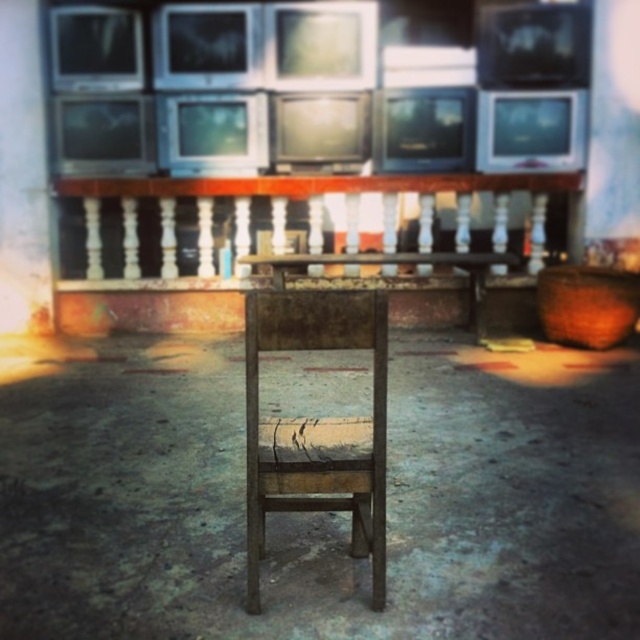
Question: Can you confirm if white wooden balustrade at center is positioned above rusty metal chair at center?

Choices:
 (A) no
 (B) yes

Answer: (B)

Question: Is white wooden balustrade at center further to the viewer compared to rusty metal chair at center?

Choices:
 (A) no
 (B) yes

Answer: (B)

Question: Is the position of white wooden balustrade at center less distant than that of rusty metal chair at center?

Choices:
 (A) yes
 (B) no

Answer: (B)